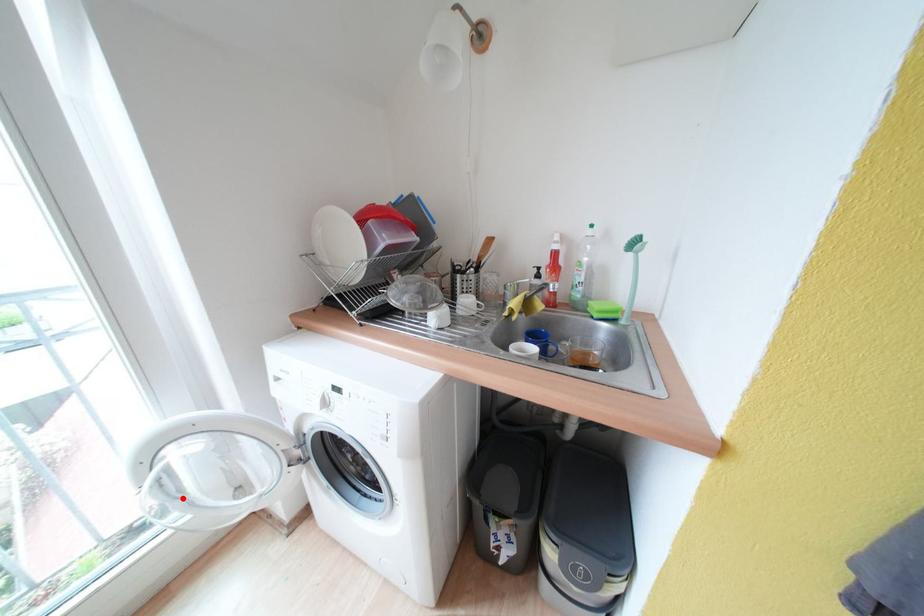
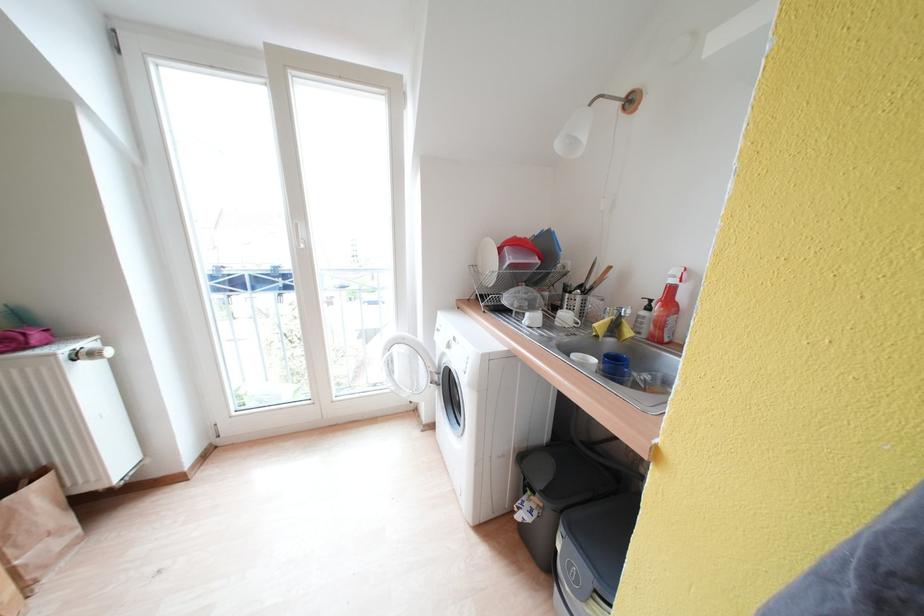
Locate, in the second image, the point that corresponds to the highlighted location in the first image.

(397, 376)